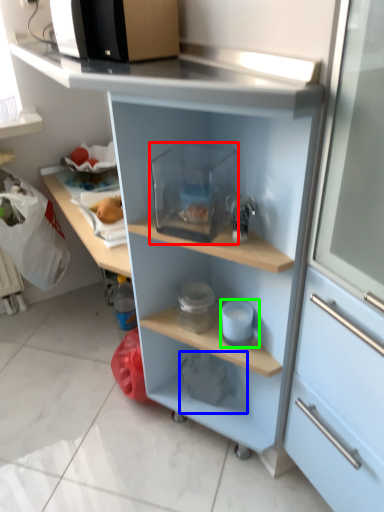
Question: Estimate the real-world distances between objects in this image. Which object is farther from appliance (highlighted by a red box), appliance (highlighted by a blue box) or appliance (highlighted by a green box)?

Choices:
 (A) appliance
 (B) appliance

Answer: (A)